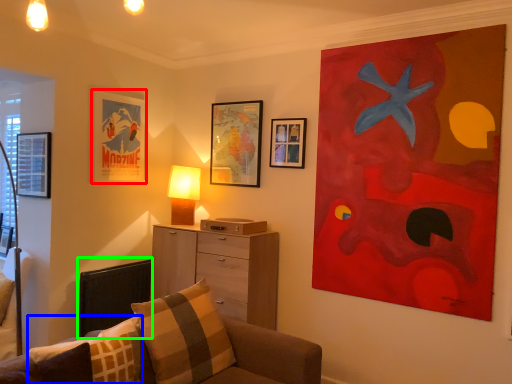
Question: Which object is positioned farthest from picture frame (highlighted by a red box)? Select from pillow (highlighted by a blue box) and swivel chair (highlighted by a green box).

Choices:
 (A) pillow
 (B) swivel chair

Answer: (A)